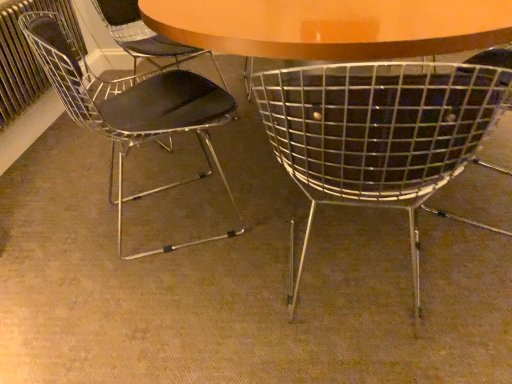
Question: From a real-world perspective, is metallic wire chair at left, the 1th chair from the left, under metal mesh chair at center, the first chair when ordered from right to left?

Choices:
 (A) yes
 (B) no

Answer: (B)

Question: From the image's perspective, does metallic wire chair at left, the 1th chair from the left, appear higher than metal mesh chair at center, which is the second chair in left-to-right order?

Choices:
 (A) no
 (B) yes

Answer: (B)

Question: Can you see metallic wire chair at left, which appears as the 2th chair when viewed from the right, touching metal mesh chair at center, which is the second chair in left-to-right order?

Choices:
 (A) yes
 (B) no

Answer: (B)

Question: From the image's perspective, would you say metallic wire chair at left, which appears as the 2th chair when viewed from the right, is shown under metal mesh chair at center, the first chair when ordered from right to left?

Choices:
 (A) no
 (B) yes

Answer: (A)

Question: Considering the relative sizes of metallic wire chair at left, which appears as the 2th chair when viewed from the right, and metal mesh chair at center, the first chair when ordered from right to left, in the image provided, is metallic wire chair at left, which appears as the 2th chair when viewed from the right, wider than metal mesh chair at center, the first chair when ordered from right to left,?

Choices:
 (A) no
 (B) yes

Answer: (A)

Question: Would you say metallic wire chair at left, which appears as the 2th chair when viewed from the right, is outside metal mesh chair at center, the first chair when ordered from right to left?

Choices:
 (A) no
 (B) yes

Answer: (B)

Question: Can you confirm if metal mesh chair at center, the first chair when ordered from right to left, is shorter than metallic wire chair at left, the 1th chair from the left?

Choices:
 (A) no
 (B) yes

Answer: (B)

Question: Is metal mesh chair at center, the first chair when ordered from right to left, thinner than metallic wire chair at left, the 1th chair from the left?

Choices:
 (A) yes
 (B) no

Answer: (B)

Question: Does metal mesh chair at center, the first chair when ordered from right to left, come in front of metallic wire chair at left, the 1th chair from the left?

Choices:
 (A) yes
 (B) no

Answer: (A)

Question: Is metal mesh chair at center, the first chair when ordered from right to left, taller than metallic wire chair at left, which appears as the 2th chair when viewed from the right?

Choices:
 (A) no
 (B) yes

Answer: (A)

Question: Is metal mesh chair at center, which is the second chair in left-to-right order, facing towards metallic wire chair at left, which appears as the 2th chair when viewed from the right?

Choices:
 (A) no
 (B) yes

Answer: (A)

Question: Is metal mesh chair at center, which is the second chair in left-to-right order, not within metallic wire chair at left, the 1th chair from the left?

Choices:
 (A) yes
 (B) no

Answer: (A)

Question: Considering the relative positions of metallic wire chair at left, the 1th chair from the left, and metallic radiator at left in the image provided, is metallic wire chair at left, the 1th chair from the left, to the right of metallic radiator at left from the viewer's perspective?

Choices:
 (A) yes
 (B) no

Answer: (A)